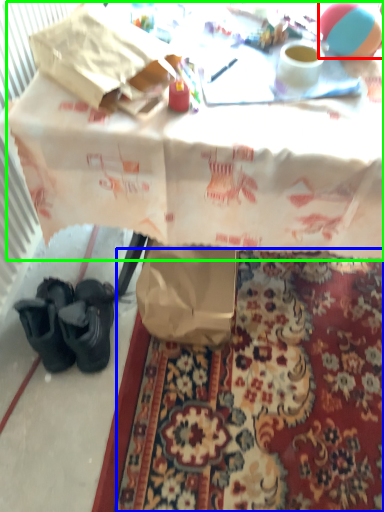
Question: Based on their relative distances, which object is farther from ball (highlighted by a red box)? Choose from mat (highlighted by a blue box) and table (highlighted by a green box).

Choices:
 (A) mat
 (B) table

Answer: (A)